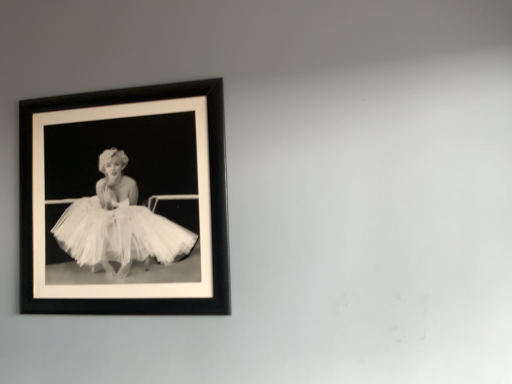
Describe the element at coordinates (124, 202) in the screenshot. I see `black matte picture frame at left` at that location.

Measure the distance between black matte picture frame at left and camera.

3.98 feet.

Identify the location of black matte picture frame at left. (124, 202).

Identify the location of black matte picture frame at left. This screenshot has width=512, height=384. (124, 202).